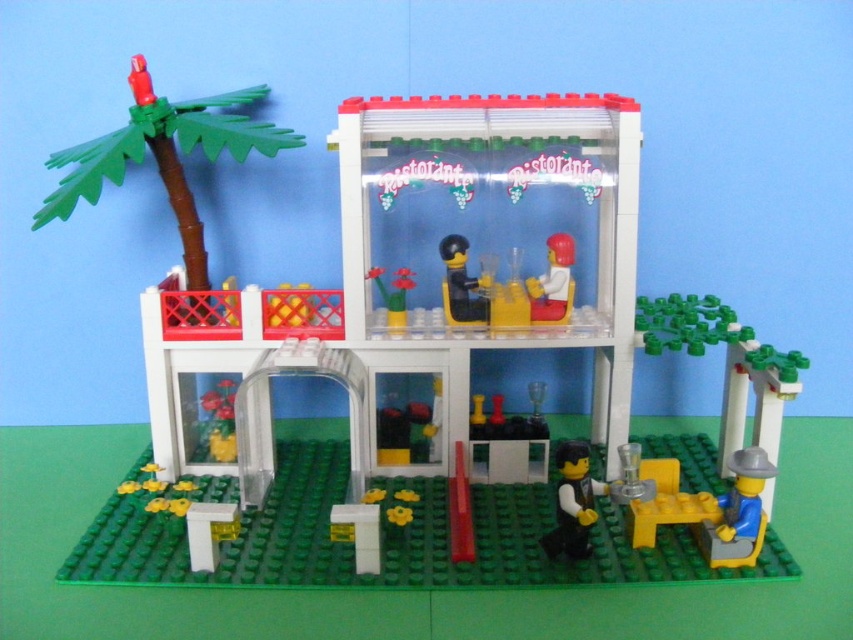
Is black plastic figure at lower right thinner than white plastic cup at upper center?

No, black plastic figure at lower right is not thinner than white plastic cup at upper center.

Is point (569, 456) farther from camera compared to point (567, 288)?

No.

Identify the location of black plastic figure at lower right. Image resolution: width=853 pixels, height=640 pixels. (573, 502).

Does green matte palm tree at left have a lesser width compared to white plastic cup at upper center?

No, green matte palm tree at left is not thinner than white plastic cup at upper center.

Between point (248, 150) and point (556, 266), which one is positioned behind?

The point (556, 266) is behind.

In order to click on green matte palm tree at left in this screenshot , I will do `click(164, 156)`.

Where is `blue plastic cowboy at lower right`? The height and width of the screenshot is (640, 853). blue plastic cowboy at lower right is located at coordinates [x=738, y=513].

Consider the image. Does blue plastic cowboy at lower right have a lesser height compared to white plastic cup at upper center?

Yes, blue plastic cowboy at lower right is shorter than white plastic cup at upper center.

Is point (724, 557) less distant than point (567, 257)?

Yes, it is in front of point (567, 257).

Where is `blue plastic cowboy at lower right`? The height and width of the screenshot is (640, 853). blue plastic cowboy at lower right is located at coordinates (738, 513).